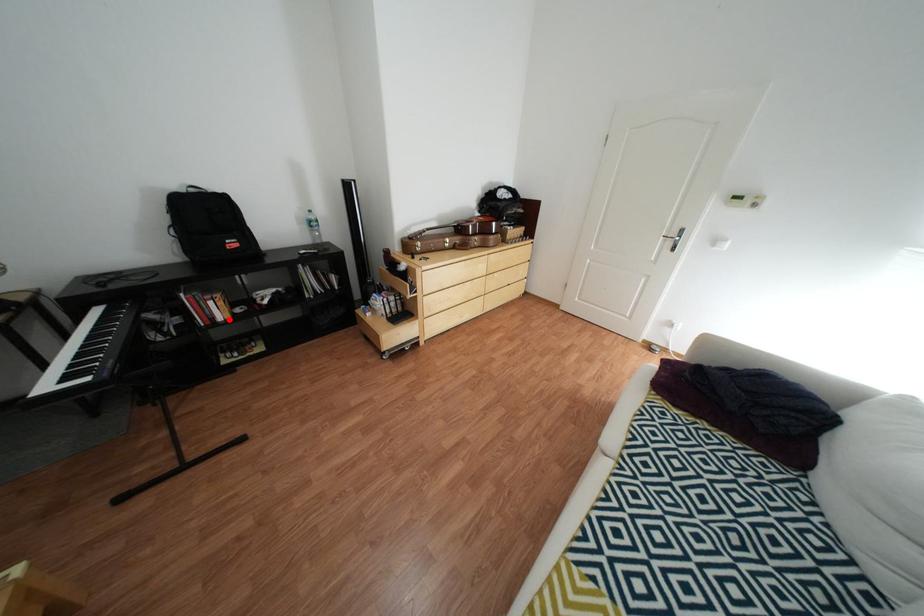
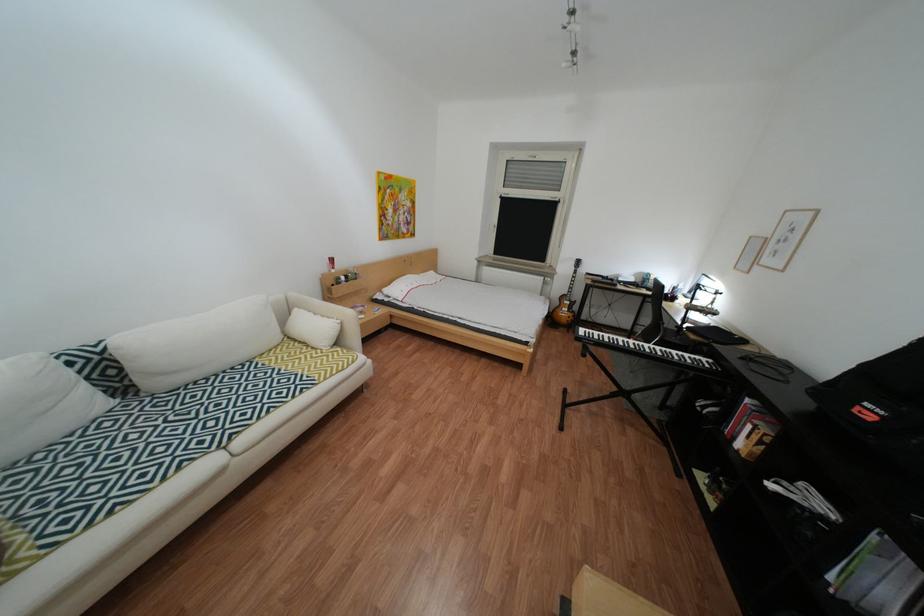
Question: I am providing you with two images of the same scene from different viewpoints. A red point is shown in image1. For the corresponding object point in image2, is it positioned nearer or farther from the camera?

Choices:
 (A) Nearer
 (B) Farther

Answer: (B)